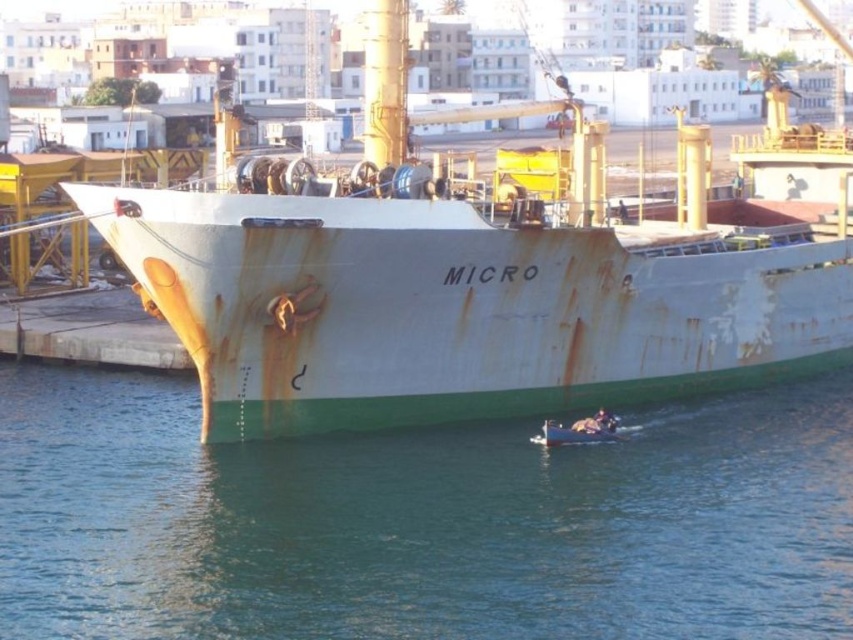
You are standing on the deck of the ship named MICRO and want to take a photo of the point at coordinates [608,529]. If your camera has a maximum range of 40 meters, will you be able to capture that point in your photo?

The point at coordinates [608,529] is 40.86 meters away from the camera. Since the camera can only capture up to 40 meters, you will not be able to capture that point in your photo.